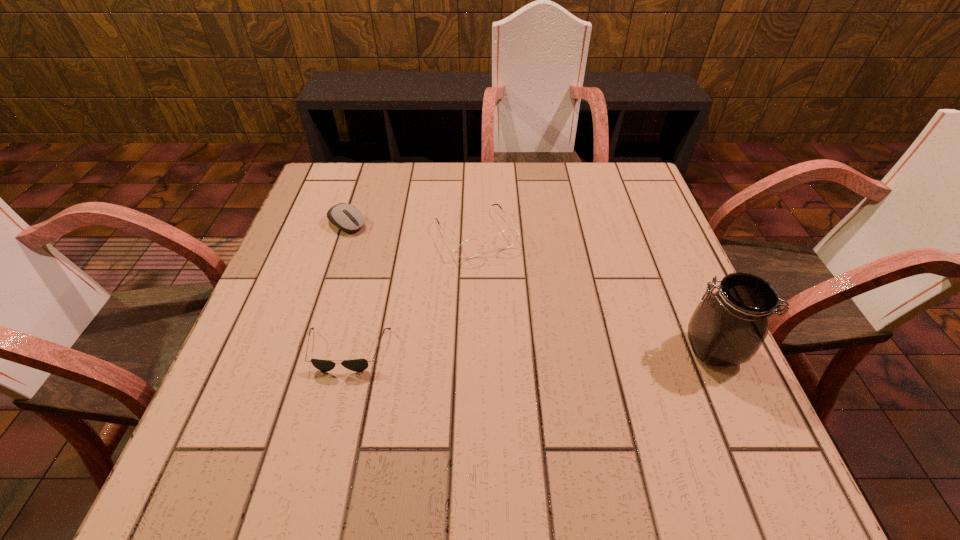
Identify the location of free space in the image that satisfies the following two spatial constraints: 1. on the front side of the second object from right to left; 2. on the lid of the jar. (475, 349).